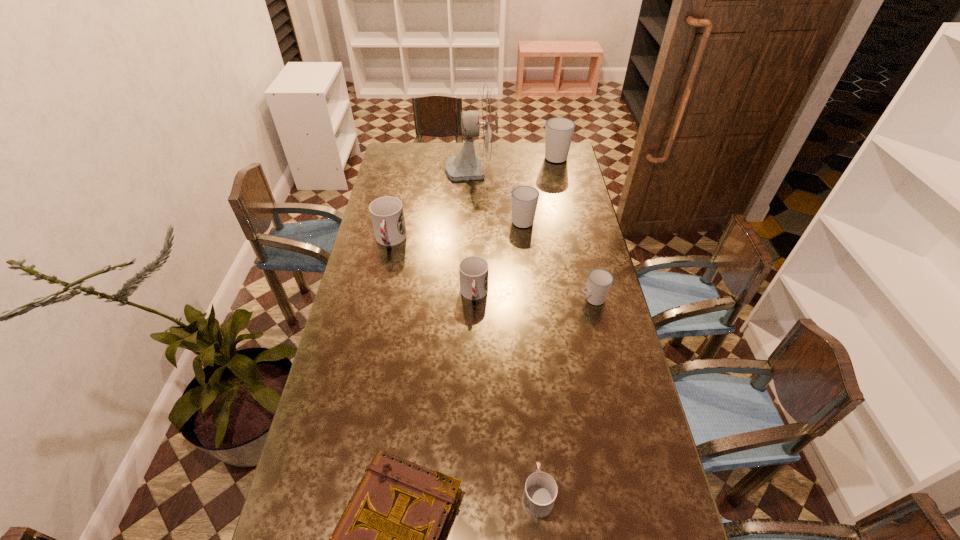
Where is `unoccupied position between the farthest red cup and the biggest white cup`? unoccupied position between the farthest red cup and the biggest white cup is located at coordinates (473, 198).

Identify the location of free space between the nearest white cup and the white fan. (532, 233).

Where is `free space that is in between the second cup from left to right and the fan`? Image resolution: width=960 pixels, height=540 pixels. free space that is in between the second cup from left to right and the fan is located at coordinates tap(472, 231).

This screenshot has height=540, width=960. In order to click on object that is the seventh closest to the white fan in this screenshot , I will do `click(540, 492)`.

Select which object appears as the third closest to the shortest object. Please provide its 2D coordinates. Your answer should be formatted as a tuple, i.e. [(x, y)], where the tuple contains the x and y coordinates of a point satisfying the conditions above.

[(599, 283)]

Locate an element on the screen. This screenshot has width=960, height=540. the third closest cup to the brown hardback book is located at coordinates [x=599, y=283].

Locate which cup ranks in proximity to the smallest red cup. Please provide its 2D coordinates. Your answer should be formatted as a tuple, i.e. [(x, y)], where the tuple contains the x and y coordinates of a point satisfying the conditions above.

[(473, 271)]

Identify which white cup is located as the nearest to the biggest white cup. Please provide its 2D coordinates. Your answer should be formatted as a tuple, i.e. [(x, y)], where the tuple contains the x and y coordinates of a point satisfying the conditions above.

[(524, 199)]

Where is `white cup that is the third nearest to the smallest red cup`? white cup that is the third nearest to the smallest red cup is located at coordinates (559, 131).

Choose which red cup is the second nearest neighbor to the second nearest red cup. Please provide its 2D coordinates. Your answer should be formatted as a tuple, i.e. [(x, y)], where the tuple contains the x and y coordinates of a point satisfying the conditions above.

[(540, 492)]